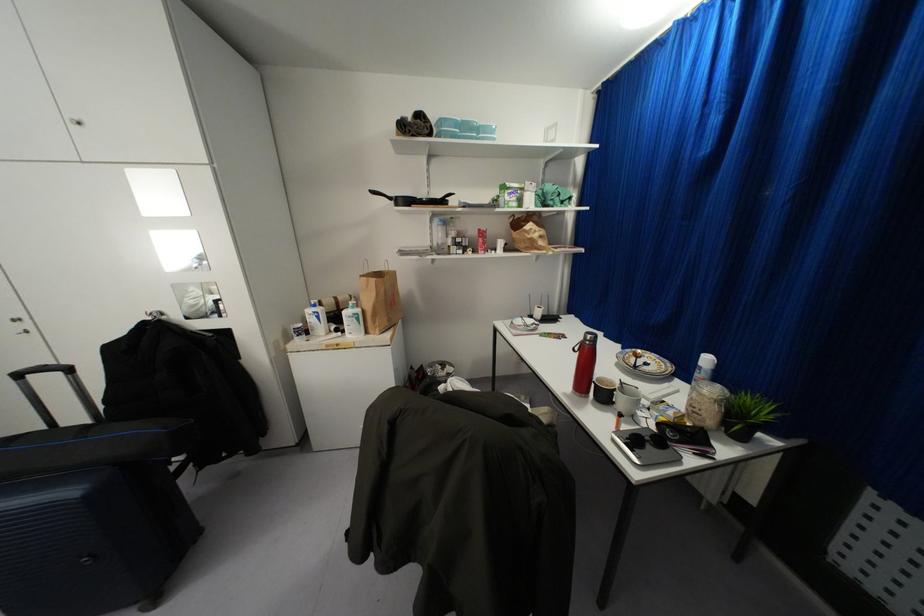
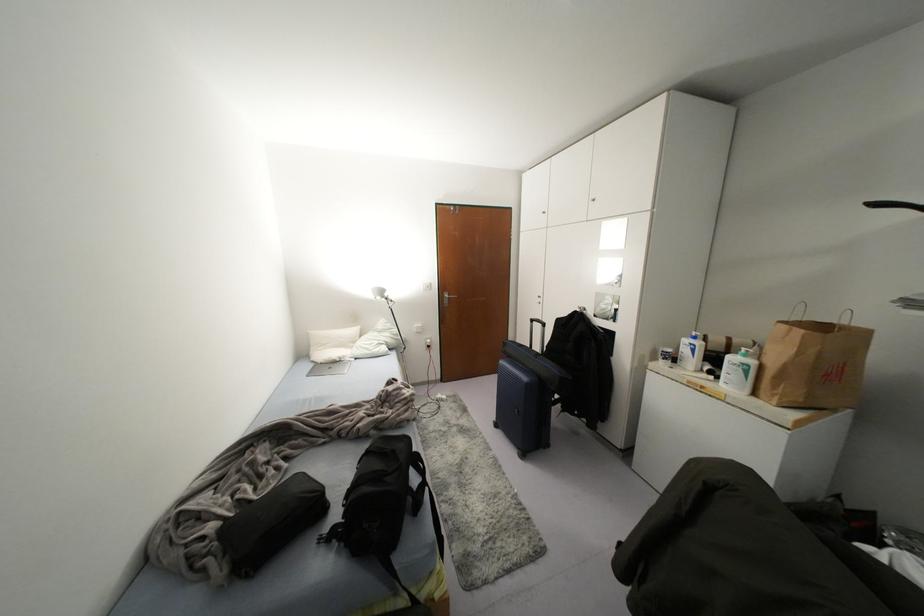
In the second image, find the point that corresponds to the point at 358,310 in the first image.

(751, 362)